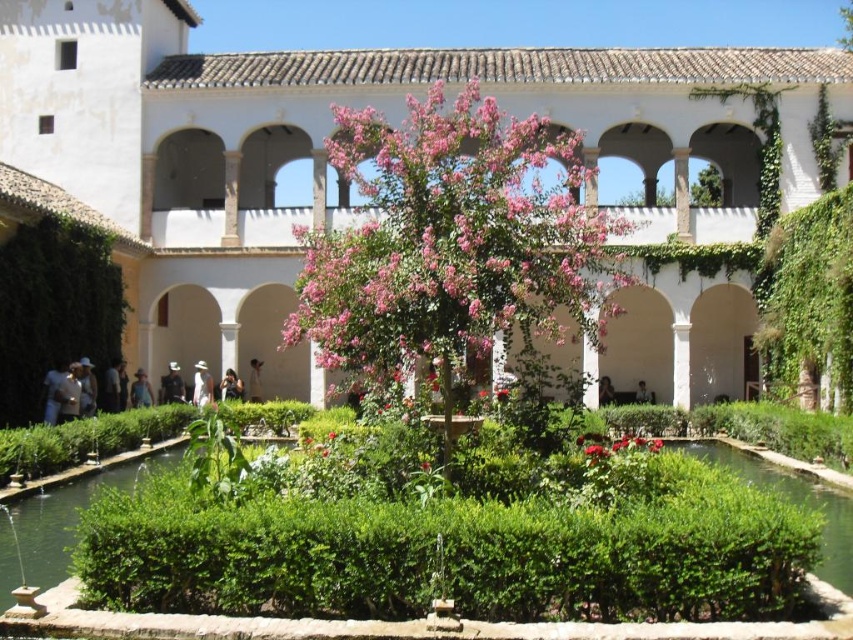
You are an artist standing in the courtyard scene. You want to paint the vivid red petals at center and the dark brown leather jacket at center. Which object should you focus on first if you want to paint the taller one first?

The vivid red petals at center is much taller than the dark brown leather jacket at center, so you should focus on painting the vivid red petals at center first.